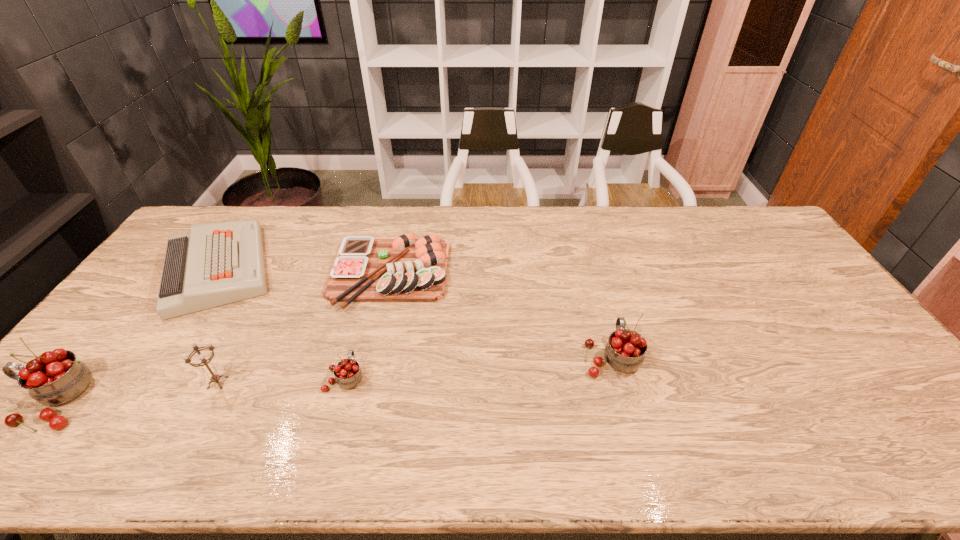
Where is `free space located 0.350m on the handle side of the rightmost object`? This screenshot has height=540, width=960. free space located 0.350m on the handle side of the rightmost object is located at coordinates (584, 256).

Find the location of `free space located on the handle side of the rightmost object`. free space located on the handle side of the rightmost object is located at coordinates (586, 262).

I want to click on vacant space located 0.340m on the handle side of the rightmost object, so click(585, 258).

Where is `vacant space located 0.100m on the front of the computer keyboard`? The width and height of the screenshot is (960, 540). vacant space located 0.100m on the front of the computer keyboard is located at coordinates (164, 348).

This screenshot has height=540, width=960. I want to click on free region located 0.050m on the left of the platter, so click(x=317, y=273).

The width and height of the screenshot is (960, 540). Identify the location of vacant space located on the right of the candle holder. (300, 382).

The height and width of the screenshot is (540, 960). Find the location of `computer keyboard located at the far edge`. computer keyboard located at the far edge is located at coordinates (214, 264).

Locate an element on the screen. platter situated at the far edge is located at coordinates (405, 269).

You are a GUI agent. You are given a task and a screenshot of the screen. Output one action in this format:
    pyautogui.click(x=<x>, y=<y>)
    Task: Click on the cherry at the near edge
    Image resolution: width=960 pixels, height=540 pixels.
    Given the screenshot: What is the action you would take?
    pyautogui.click(x=348, y=374)

Where is `candle holder located in the near edge section of the desktop`? This screenshot has height=540, width=960. candle holder located in the near edge section of the desktop is located at coordinates (214, 378).